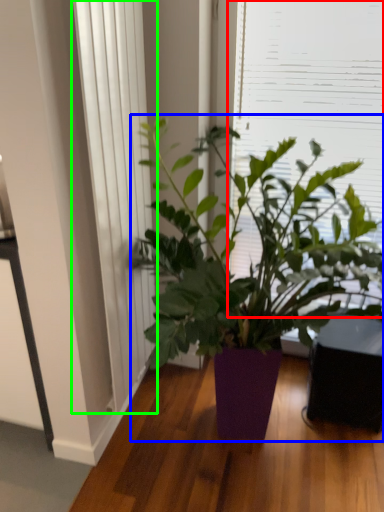
Question: Which object is the farthest from window screen (highlighted by a red box)? Choose among these: houseplant (highlighted by a blue box) or curtain (highlighted by a green box).

Choices:
 (A) houseplant
 (B) curtain

Answer: (B)